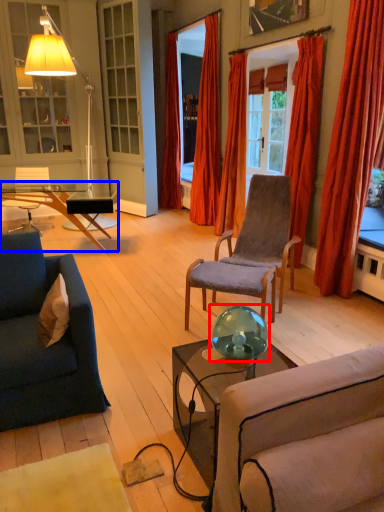
Question: Which object appears closest to the camera in this image, teal (highlighted by a red box) or coffee table (highlighted by a blue box)?

Choices:
 (A) teal
 (B) coffee table

Answer: (A)